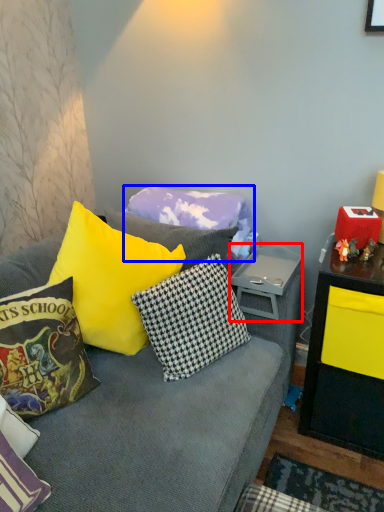
Question: Which object appears closest to the camera in this image, side table (highlighted by a red box) or pillow (highlighted by a blue box)?

Choices:
 (A) side table
 (B) pillow

Answer: (A)